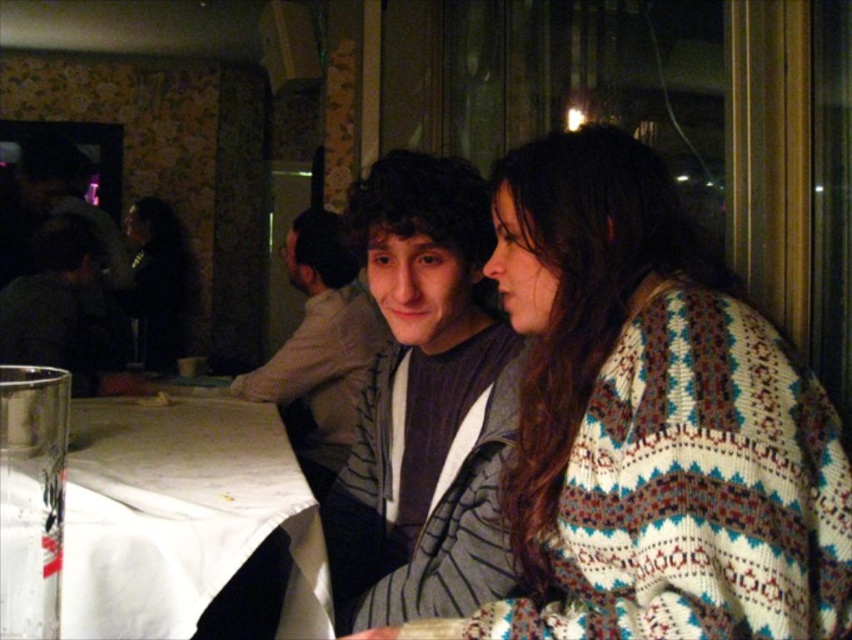
You are a photographer taking a picture of the scene. You notice the gray striped jacket at center and the white cloth at lower left. Which object is located to the right of the other?

The gray striped jacket at center is positioned on the right side of white cloth at lower left.

Consider the image. You are a photographer taking a picture of the scene. You notice the gray striped jacket at center and the white cloth at lower left. Which object will appear closer to the camera in the photo?

The gray striped jacket at center will appear closer to the camera because it is in front of the white cloth at lower left.

You are a photographer trying to capture a candid shot of the two people at the table. You notice the gray striped jacket at center and the white cloth at lower left in your frame. Which object is narrower in width?

The gray striped jacket at center is thinner than the white cloth at lower left, so the gray striped jacket at center is narrower in width.